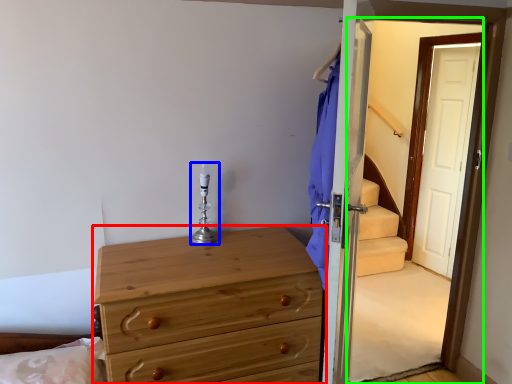
Question: Estimate the real-world distances between objects in this image. Which object is closer to chest of drawers (highlighted by a red box), candle holder (highlighted by a blue box) or screen door (highlighted by a green box)?

Choices:
 (A) candle holder
 (B) screen door

Answer: (A)